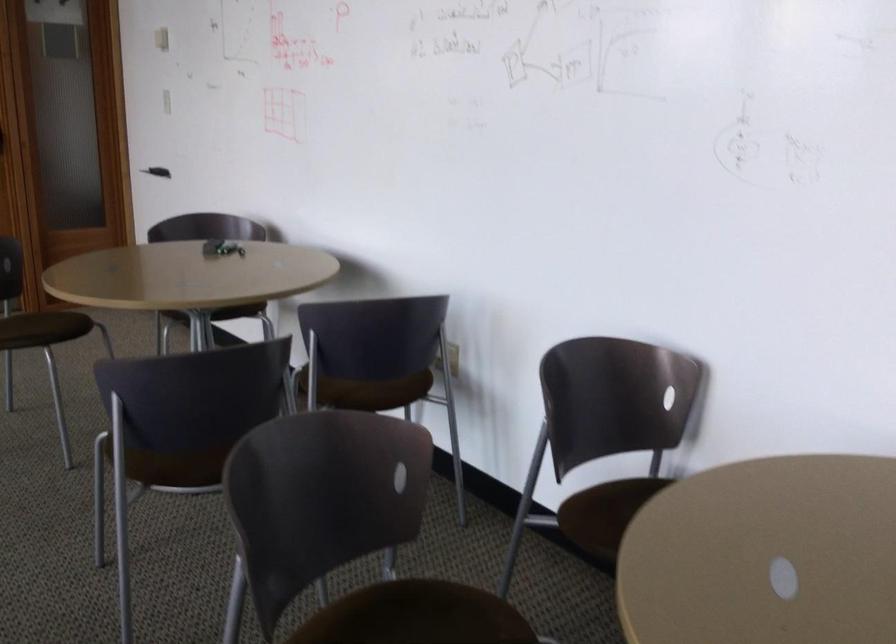
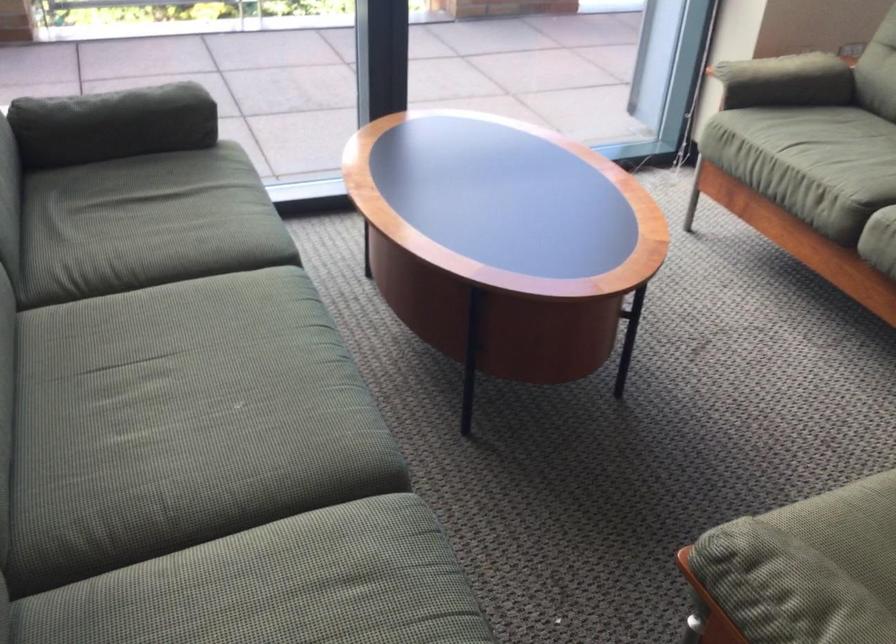
How did the camera likely rotate?

The camera's rotation is toward left-down.